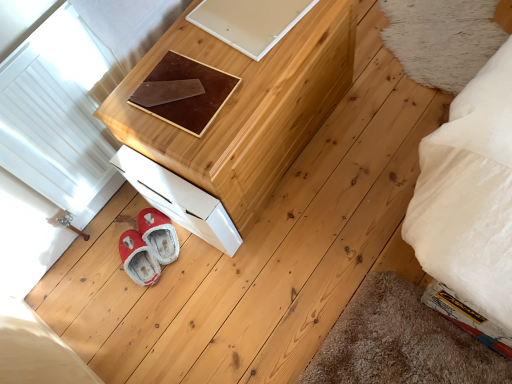
Locate an element on the screen. This screenshot has width=512, height=384. space that is in front of fuzzy red slippers at lower left is located at coordinates (139, 302).